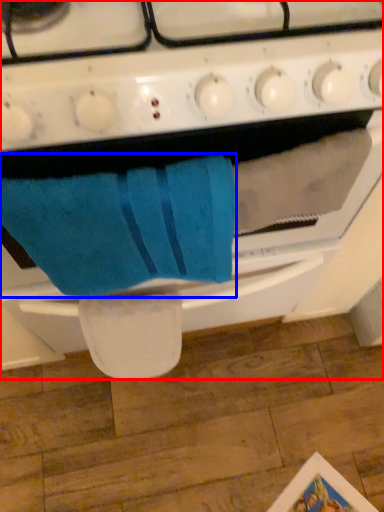
Question: Which object appears closest to the camera in this image, oven (highlighted by a red box) or bath towel (highlighted by a blue box)?

Choices:
 (A) oven
 (B) bath towel

Answer: (A)